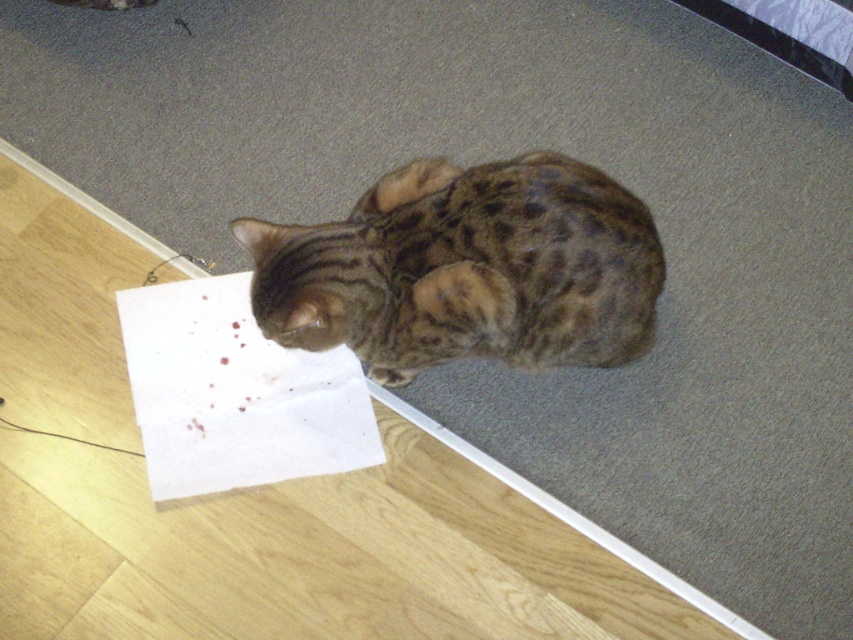
How much distance is there between spotted fur cat at center and white paper at lower left?

11.23 inches

Does spotted fur cat at center have a greater width compared to white paper at lower left?

Correct, the width of spotted fur cat at center exceeds that of white paper at lower left.

Describe the element at coordinates (465, 269) in the screenshot. I see `spotted fur cat at center` at that location.

Locate an element on the screen. The image size is (853, 640). spotted fur cat at center is located at coordinates (465, 269).